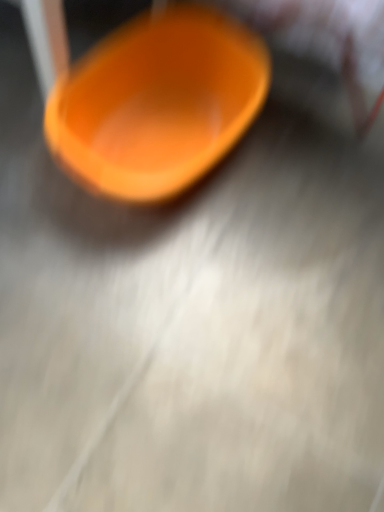
What do you see at coordinates (157, 104) in the screenshot? The image size is (384, 512). I see `orange glossy bowl at center` at bounding box center [157, 104].

The height and width of the screenshot is (512, 384). I want to click on orange glossy bowl at center, so click(157, 104).

This screenshot has width=384, height=512. In order to click on orange glossy bowl at center in this screenshot , I will do `click(157, 104)`.